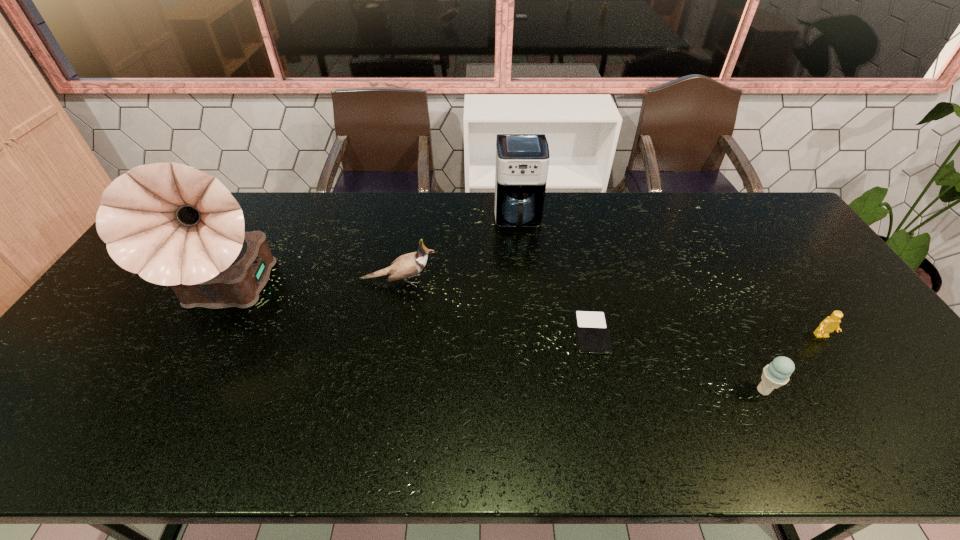
At what (x,y) coordinates should I click in order to perform the action: click on free space at the far edge. Please return your answer as a coordinate pair (x, y). Looking at the image, I should click on (447, 234).

Where is `vacant space at the near edge`? vacant space at the near edge is located at coordinates (193, 454).

Where is `vacant space at the near right corner of the desktop`? vacant space at the near right corner of the desktop is located at coordinates pyautogui.click(x=932, y=449).

Find the location of a particular element. This screenshot has width=960, height=540. vacant area that lies between the nearest object and the coffee maker is located at coordinates (640, 306).

Where is `vacant space in between the fourth object from left to right and the Lego`? vacant space in between the fourth object from left to right and the Lego is located at coordinates (707, 334).

Image resolution: width=960 pixels, height=540 pixels. I want to click on blank region between the bird and the rightmost object, so click(610, 309).

The height and width of the screenshot is (540, 960). I want to click on vacant area that lies between the fifth shortest object and the Lego, so click(669, 279).

The image size is (960, 540). I want to click on free area in between the record player and the rightmost object, so click(x=526, y=316).

At what (x,y) coordinates should I click in order to perform the action: click on vacant area that lies between the second object from left to right and the third object from right to left. Please return your answer as a coordinate pair (x, y). The height and width of the screenshot is (540, 960). Looking at the image, I should click on (495, 307).

The height and width of the screenshot is (540, 960). Identify the location of free point between the record player and the second object from right to left. (496, 343).